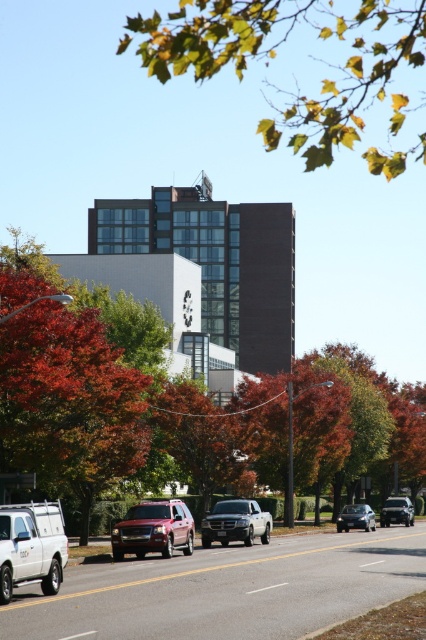
Based on the photo, can you confirm if green leafy tree at center is thinner than satin black sedan at center?

No, green leafy tree at center is not thinner than satin black sedan at center.

Does green leafy tree at center come in front of satin black sedan at center?

Yes, green leafy tree at center is in front of satin black sedan at center.

This screenshot has width=426, height=640. Find the location of `green leafy tree at center`. green leafy tree at center is located at coordinates (118, 401).

Who is more forward, (222, 502) or (351, 515)?

Point (222, 502) is in front.

The image size is (426, 640). Describe the element at coordinates (236, 522) in the screenshot. I see `silver metallic truck at center` at that location.

The height and width of the screenshot is (640, 426). Find the location of `silver metallic truck at center`. silver metallic truck at center is located at coordinates (236, 522).

Who is more forward, (149, 472) or (218, 536)?

Point (218, 536) is more forward.

In the scene shown: Who is more forward, (293, 436) or (207, 538)?

Positioned in front is point (207, 538).

You are a GUI agent. You are given a task and a screenshot of the screen. Output one action in this format:
    pyautogui.click(x=<x>, y=<y>)
    Task: Click on the green leafy tree at center
    This screenshot has width=426, height=640.
    Given the screenshot: What is the action you would take?
    pyautogui.click(x=118, y=401)